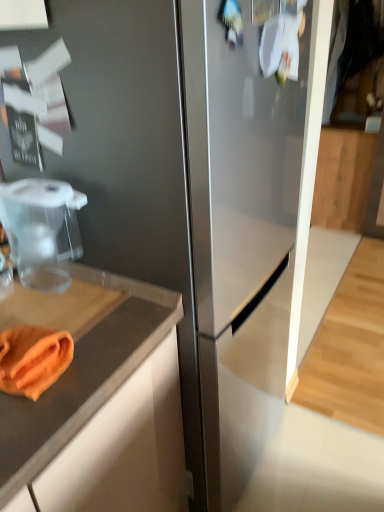
This screenshot has width=384, height=512. I want to click on vacant space in front of transparent plastic food processor at left, so click(x=42, y=308).